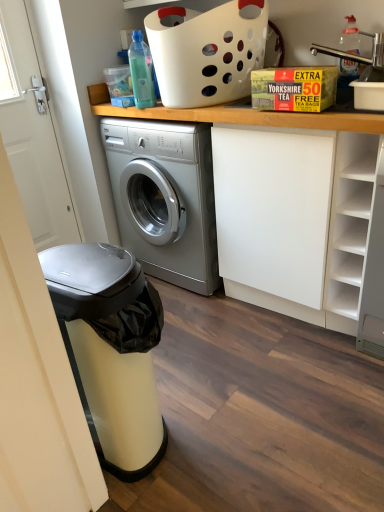
Question: Visually, is transparent plastic bottle at upper left, arranged as the 2th bottle when viewed from the right, positioned to the left or to the right of yellow cardboard box at upper center?

Choices:
 (A) right
 (B) left

Answer: (B)

Question: Is transparent plastic bottle at upper left, arranged as the 2th bottle when viewed from the right, bigger or smaller than yellow cardboard box at upper center?

Choices:
 (A) big
 (B) small

Answer: (B)

Question: Which of these objects is positioned closest to the yellow cardboard box at upper center?

Choices:
 (A) metallic stainless steel dishwasher at left
 (B) white plastic basket at upper center
 (C) white matte shelf at right
 (D) metallic silver faucet at upper right
 (E) transparent plastic bottle at upper left, the 1th bottle from the left

Answer: (E)

Question: Which is farther from the white matte shelf at right?

Choices:
 (A) metallic stainless steel dishwasher at left
 (B) clear plastic bottle at upper right, acting as the first bottle starting from the right
 (C) metallic silver faucet at upper right
 (D) white plastic basket at upper center
 (E) yellow cardboard box at upper center

Answer: (A)